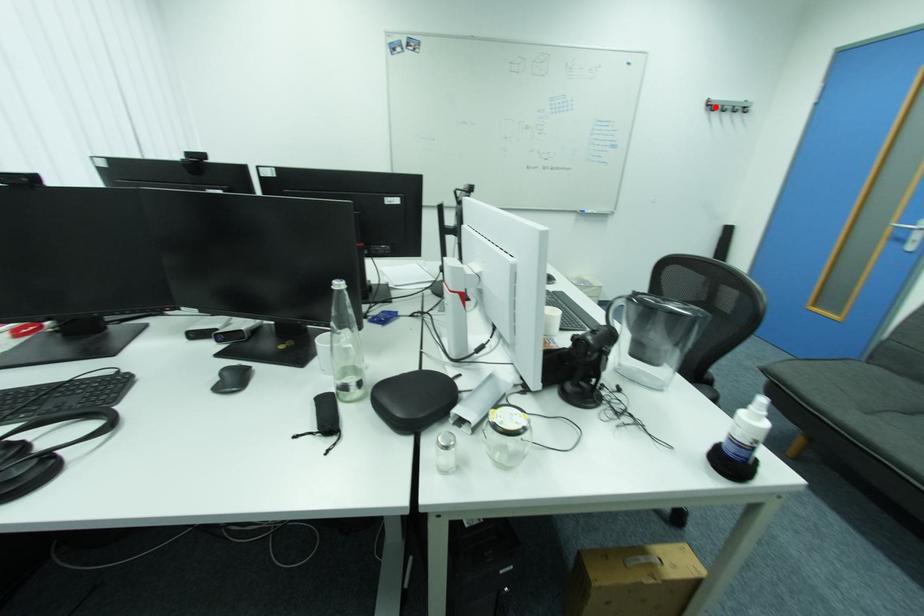
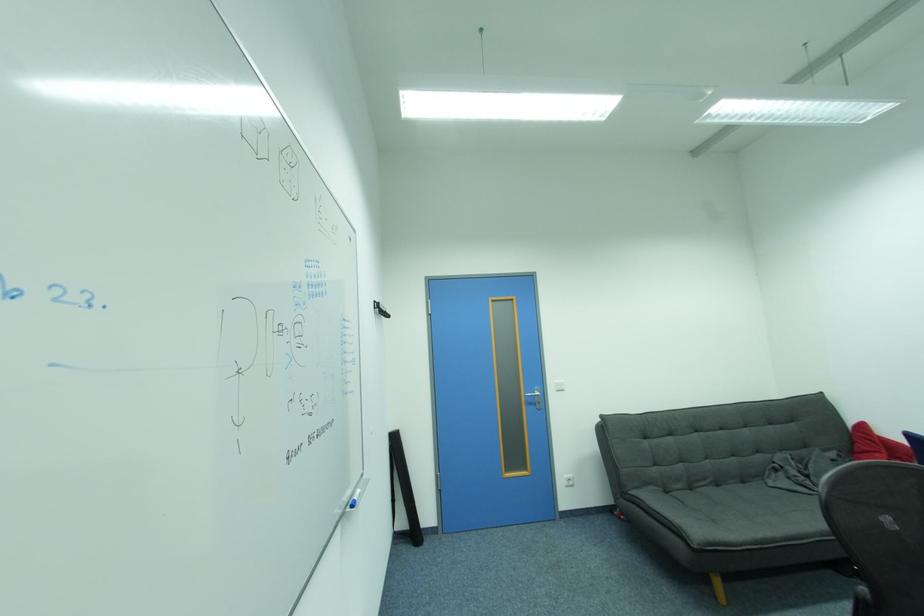
Question: I am providing you with two images of the same scene from different viewpoints. A red point is marked on the first image. Is the red point's position out of view in image 2?

Choices:
 (A) Yes
 (B) No

Answer: (A)